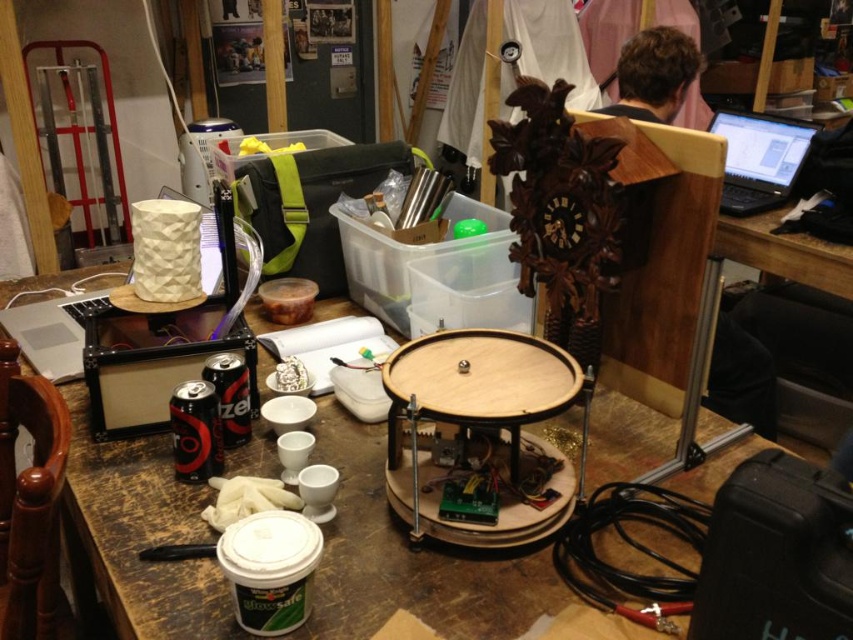
Can you confirm if wooden table at center is positioned below brown hair at upper right?

Indeed, wooden table at center is positioned under brown hair at upper right.

Is point (555, 579) farther from camera compared to point (671, 35)?

No, it is in front of (671, 35).

Image resolution: width=853 pixels, height=640 pixels. I want to click on wooden table at center, so click(x=409, y=557).

Can you confirm if wooden table at center is taller than wooden round table at center?

Yes, wooden table at center is taller than wooden round table at center.

Does point (822, 452) come closer to viewer compared to point (541, 522)?

No.

Locate an element on the screen. The width and height of the screenshot is (853, 640). wooden table at center is located at coordinates (409, 557).

This screenshot has height=640, width=853. I want to click on wooden table at center, so coord(409,557).

Does wooden table at center have a larger size compared to black plastic laptop at upper right?

Yes, wooden table at center is bigger than black plastic laptop at upper right.

Is point (363, 506) positioned in front of point (715, 116)?

Yes, it is.

In order to click on wooden table at center in this screenshot , I will do `click(409, 557)`.